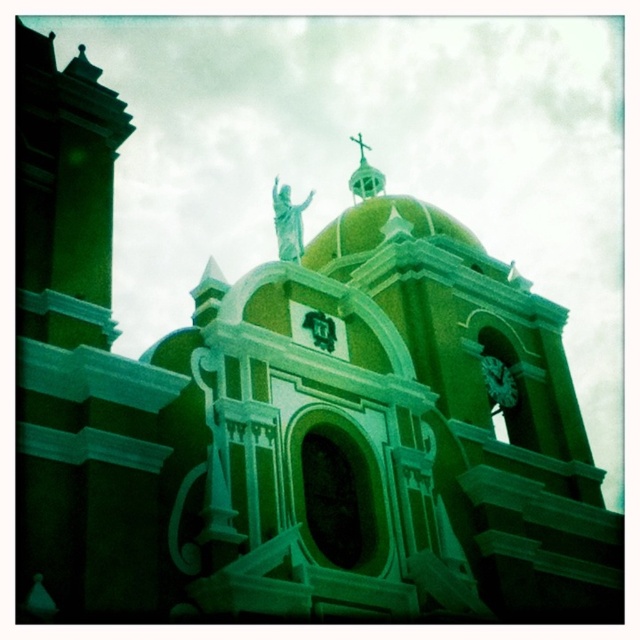
Is green marble statue at upper center positioned at the back of metallic gold cross at upper center?

No, green marble statue at upper center is closer to the viewer.

Is point (312, 193) behind point (362, 141)?

No, (312, 193) is in front of (362, 141).

You are a GUI agent. You are given a task and a screenshot of the screen. Output one action in this format:
    pyautogui.click(x=<x>, y=<y>)
    Task: Click on the green marble statue at upper center
    The width and height of the screenshot is (640, 640).
    Given the screenshot: What is the action you would take?
    pyautogui.click(x=288, y=221)